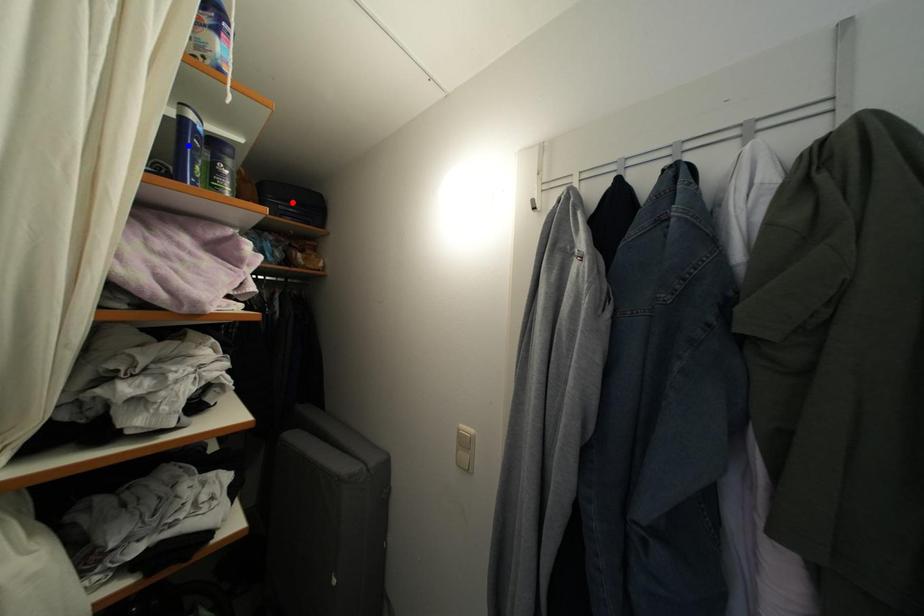
Question: Which of the two points in the image is closer to the camera?

Choices:
 (A) Blue point is closer.
 (B) Red point is closer.

Answer: (A)